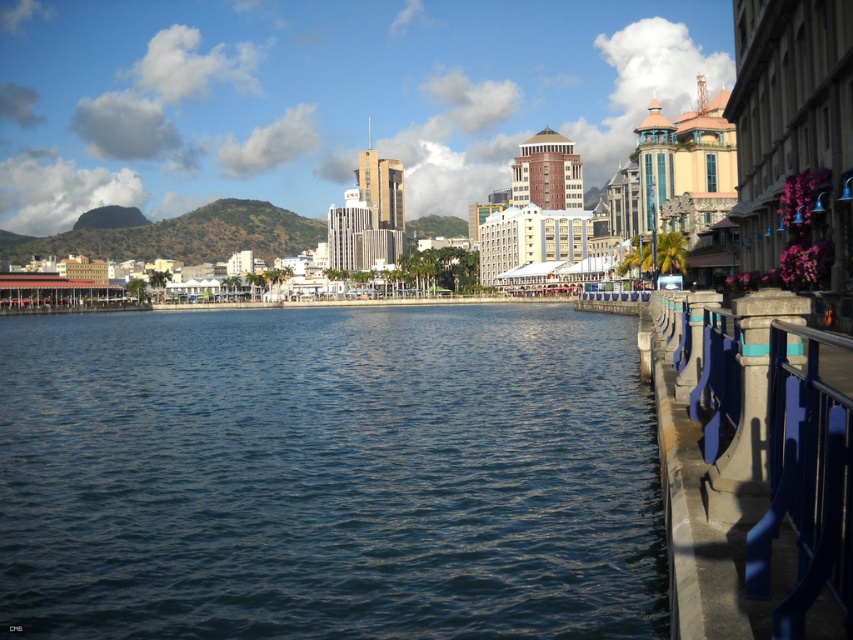
Question: Where is blue water at center located in relation to blue metallic railing at right in the image?

Choices:
 (A) below
 (B) above

Answer: (A)

Question: Can you confirm if blue water at center is positioned to the left of blue metallic railing at right?

Choices:
 (A) yes
 (B) no

Answer: (A)

Question: Is blue water at center closer to camera compared to blue metallic railing at right?

Choices:
 (A) no
 (B) yes

Answer: (A)

Question: Among these points, which one is nearest to the camera?

Choices:
 (A) click(277, 348)
 (B) click(833, 586)

Answer: (B)